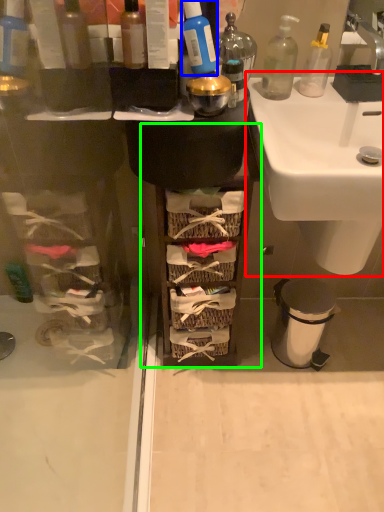
Question: Which object is the farthest from sink (highlighted by a red box)? Choose among these: cleaning product (highlighted by a blue box) or cabinetry (highlighted by a green box).

Choices:
 (A) cleaning product
 (B) cabinetry

Answer: (A)